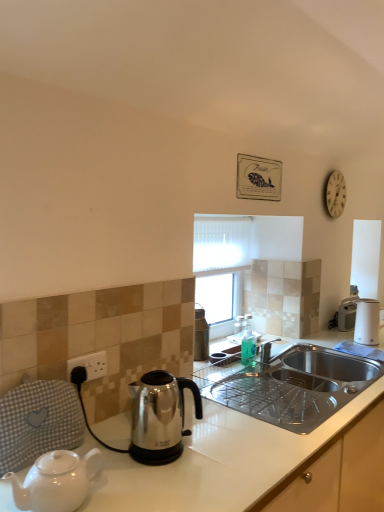
Question: From a real-world perspective, is black plastic power outlet at lower left above or below white fabric at center?

Choices:
 (A) below
 (B) above

Answer: (A)

Question: From the image's perspective, is black plastic power outlet at lower left above or below white fabric at center?

Choices:
 (A) above
 (B) below

Answer: (B)

Question: Which object is positioned closest to the white fabric at center?

Choices:
 (A) white glossy countertop at lower right
 (B) black plastic power outlet at lower left
 (C) satin silver kettle at left, marked as the 2th kettle in a back-to-front arrangement
 (D) gray checkered blanket at lower left
 (E) white plastic coffee maker at right

Answer: (A)

Question: Estimate the real-world distances between objects in this image. Which object is farther from the satin silver kettle at left, marked as the second kettle in a right-to-left arrangement?

Choices:
 (A) white glossy toaster at right
 (B) stainless steel kettle at center, which is the 2th kettle in left-to-right order
 (C) black plastic power outlet at lower left
 (D) white glossy countertop at lower right
 (E) white wooden clock at upper right

Answer: (A)